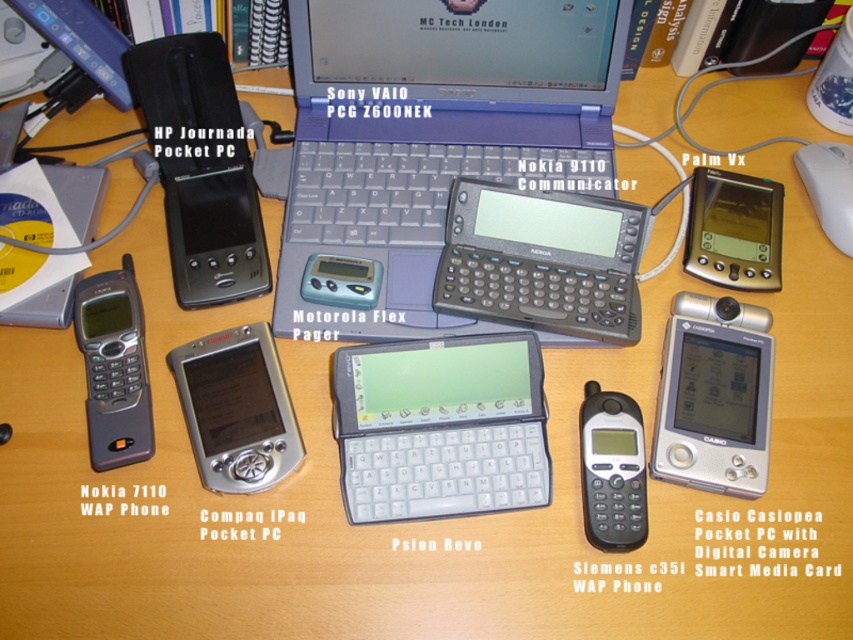
Can you confirm if black plastic nokia communicator at center is positioned above black plastic hp journda pocket pc at upper left?

No.

This screenshot has width=853, height=640. What are the coordinates of `black plastic nokia communicator at center` in the screenshot? It's located at (541, 260).

Is point (602, 280) farther from viewer compared to point (216, 150)?

No, it is in front of (216, 150).

This screenshot has width=853, height=640. What are the coordinates of `black plastic nokia communicator at center` in the screenshot? It's located at (541, 260).

Can you confirm if blue plastic laptop at center is positioned above black plastic nokia communicator at center?

Yes.

Which of these two, blue plastic laptop at center or black plastic nokia communicator at center, stands shorter?

Standing shorter between the two is black plastic nokia communicator at center.

Image resolution: width=853 pixels, height=640 pixels. In order to click on blue plastic laptop at center in this screenshot , I will do `click(428, 141)`.

Where is `blue plastic laptop at center`? This screenshot has width=853, height=640. blue plastic laptop at center is located at coordinates (428, 141).

Does matte black nokia 7110 wap phone at lower left have a larger size compared to black plastic siemens c35i smart media card wap phone at lower right?

Yes, matte black nokia 7110 wap phone at lower left is bigger than black plastic siemens c35i smart media card wap phone at lower right.

From the picture: Does matte black nokia 7110 wap phone at lower left have a lesser width compared to black plastic siemens c35i smart media card wap phone at lower right?

No.

Is point (122, 305) closer to camera compared to point (637, 525)?

No, it is behind (637, 525).

Locate an element on the screen. This screenshot has height=640, width=853. matte black nokia 7110 wap phone at lower left is located at coordinates (114, 368).